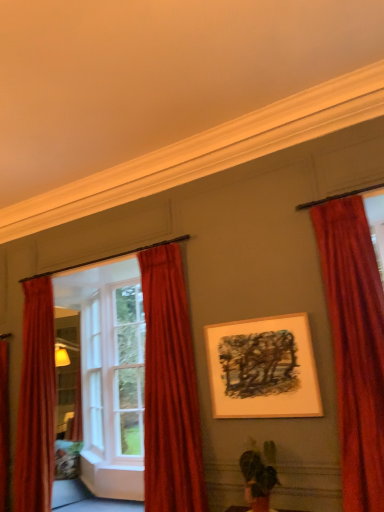
Question: Should I look upward or downward to see velvet red curtain at left, the 3th curtain in the right-to-left sequence?

Choices:
 (A) up
 (B) down

Answer: (B)

Question: Which direction should I rotate to look at velvet red curtain at center, which is the 2th curtain in left-to-right order, — up or down?

Choices:
 (A) up
 (B) down

Answer: (B)

Question: Considering the relative sizes of velvet red curtain at center, which is the 2th curtain in left-to-right order, and wooden framed artwork at center in the image provided, is velvet red curtain at center, which is the 2th curtain in left-to-right order, thinner than wooden framed artwork at center?

Choices:
 (A) no
 (B) yes

Answer: (A)

Question: Is velvet red curtain at center, which is the 2th curtain in left-to-right order, closer to camera compared to wooden framed artwork at center?

Choices:
 (A) yes
 (B) no

Answer: (B)

Question: Considering the relative positions of velvet red curtain at center, acting as the 2th curtain starting from the right, and wooden framed artwork at center in the image provided, is velvet red curtain at center, acting as the 2th curtain starting from the right, to the left of wooden framed artwork at center from the viewer's perspective?

Choices:
 (A) no
 (B) yes

Answer: (B)

Question: Can you confirm if velvet red curtain at center, acting as the 2th curtain starting from the right, is wider than wooden framed artwork at center?

Choices:
 (A) yes
 (B) no

Answer: (A)

Question: Is velvet red curtain at center, acting as the 2th curtain starting from the right, next to wooden framed artwork at center?

Choices:
 (A) no
 (B) yes

Answer: (A)

Question: From the image's perspective, would you say velvet red curtain at center, which is the 2th curtain in left-to-right order, is shown under wooden framed artwork at center?

Choices:
 (A) yes
 (B) no

Answer: (A)

Question: From a real-world perspective, is white wood window frame at left positioned under velvet red curtain at left, the 3th curtain in the right-to-left sequence, based on gravity?

Choices:
 (A) yes
 (B) no

Answer: (B)

Question: Is velvet red curtain at left, the first curtain from the left, inside white wood window frame at left?

Choices:
 (A) no
 (B) yes

Answer: (A)

Question: Is white wood window frame at left facing away from velvet red curtain at left, the 3th curtain in the right-to-left sequence?

Choices:
 (A) yes
 (B) no

Answer: (B)

Question: Is white wood window frame at left closer to camera compared to velvet red curtain at left, the first curtain from the left?

Choices:
 (A) no
 (B) yes

Answer: (B)

Question: From a real-world perspective, is white wood window frame at left physically above velvet red curtain at left, the 3th curtain in the right-to-left sequence?

Choices:
 (A) yes
 (B) no

Answer: (A)

Question: Is white wood window frame at left far away from velvet red curtain at left, the first curtain from the left?

Choices:
 (A) no
 (B) yes

Answer: (B)

Question: Is white wood window frame at left at the right side of green matte plant at lower center?

Choices:
 (A) no
 (B) yes

Answer: (A)